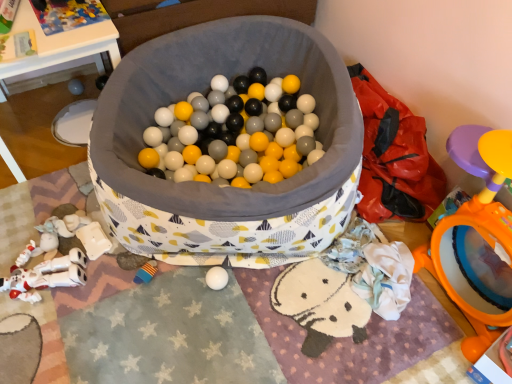
Question: From the image's perspective, is fabric-lined ball pit at center below plastic colorful puzzle pieces at upper left, placed as the 3th toy when sorted from left to right?

Choices:
 (A) yes
 (B) no

Answer: (A)

Question: Is fabric-lined ball pit at center smaller than plastic colorful puzzle pieces at upper left, placed as the 3th toy when sorted from left to right?

Choices:
 (A) no
 (B) yes

Answer: (A)

Question: Can you confirm if fabric-lined ball pit at center is bigger than plastic colorful puzzle pieces at upper left, acting as the second toy starting from the back?

Choices:
 (A) no
 (B) yes

Answer: (B)

Question: Is fabric-lined ball pit at center positioned far away from plastic colorful puzzle pieces at upper left, marked as the fifth toy in a bottom-to-top arrangement?

Choices:
 (A) yes
 (B) no

Answer: (B)

Question: Is fabric-lined ball pit at center shorter than plastic colorful puzzle pieces at upper left, which is counted as the fourth toy, starting from the front?

Choices:
 (A) no
 (B) yes

Answer: (A)

Question: From a real-world perspective, is matte gray ball at left, the 1th toy from the back, above or below soft plush toy at lower left, the third toy viewed from the back?

Choices:
 (A) above
 (B) below

Answer: (A)

Question: Is matte gray ball at left, the 1th toy from the back, wider or thinner than soft plush toy at lower left, positioned as the 5th toy in top-to-bottom order?

Choices:
 (A) thin
 (B) wide

Answer: (A)

Question: Relative to soft plush toy at lower left, the third toy viewed from the back, is matte gray ball at left, arranged as the second toy when viewed from the top, in front or behind?

Choices:
 (A) behind
 (B) front

Answer: (A)

Question: In the image, is matte gray ball at left, the fourth toy positioned from the bottom, on the left side or the right side of soft plush toy at lower left, the third toy in the front-to-back sequence?

Choices:
 (A) right
 (B) left

Answer: (B)

Question: Is soft plush toy at lower left, the third toy in the front-to-back sequence, situated inside matte gray ball at left, the fourth toy positioned from the bottom, or outside?

Choices:
 (A) outside
 (B) inside

Answer: (A)

Question: In terms of size, does soft plush toy at lower left, the third toy in the front-to-back sequence, appear bigger or smaller than matte gray ball at left, the 1th toy from the back?

Choices:
 (A) big
 (B) small

Answer: (B)

Question: In the image, is soft plush toy at lower left, positioned as the fourth toy in left-to-right order, positioned in front of or behind matte gray ball at left, the 1th toy from the back?

Choices:
 (A) behind
 (B) front

Answer: (B)

Question: Based on their positions, is soft plush toy at lower left, positioned as the 2th toy in right-to-left order, located to the left or right of matte gray ball at left, arranged as the second toy when viewed from the top?

Choices:
 (A) left
 (B) right

Answer: (B)

Question: In terms of size, does orange plastic mirror at right, arranged as the 3th toy when ordered from the bottom, appear bigger or smaller than matte gray ball at left, which appears as the first toy when viewed from the left?

Choices:
 (A) small
 (B) big

Answer: (B)

Question: Visually, is orange plastic mirror at right, acting as the 3th toy starting from the top, positioned to the left or to the right of matte gray ball at left, the 1th toy from the back?

Choices:
 (A) left
 (B) right

Answer: (B)